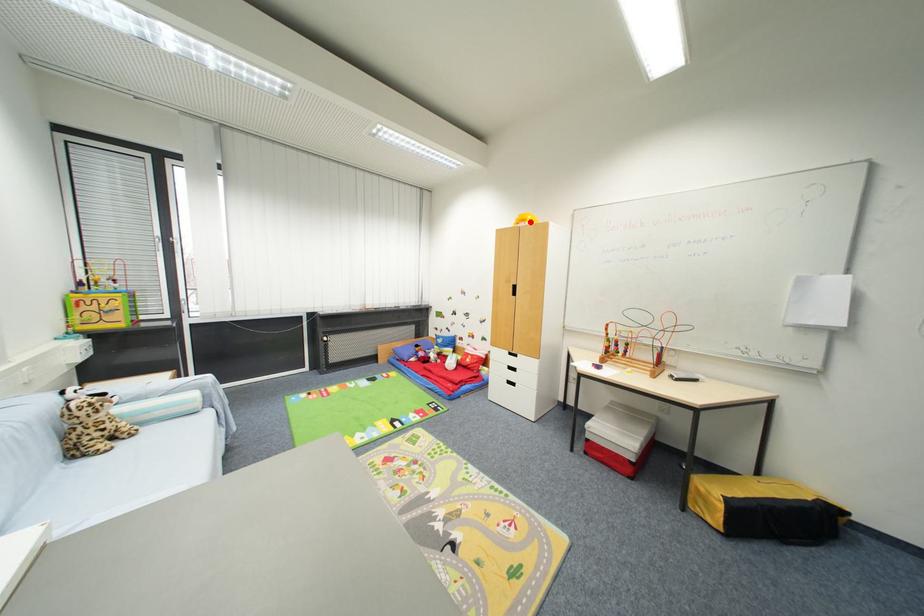
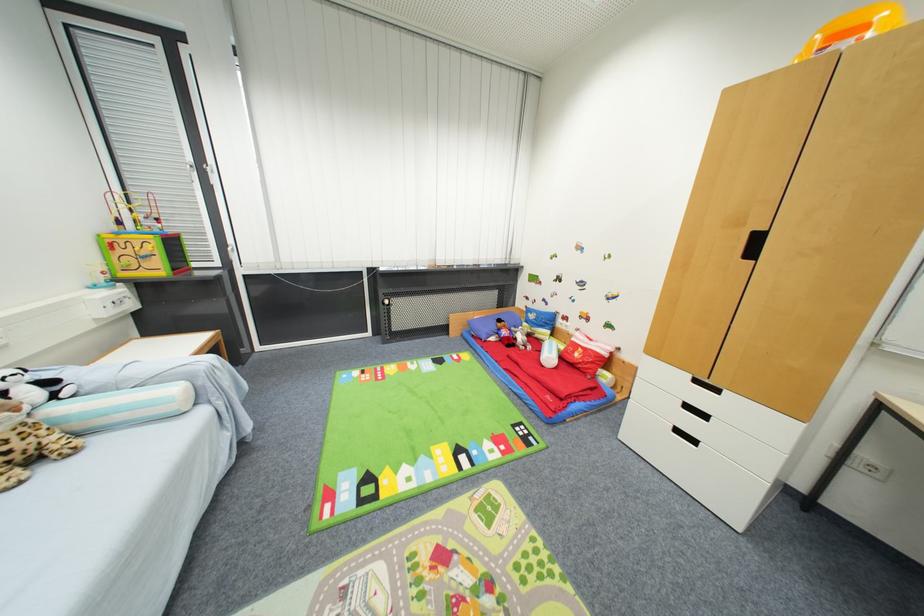
Where in the second image is the point corresponding to the highlighted location from the first image?

(868, 30)